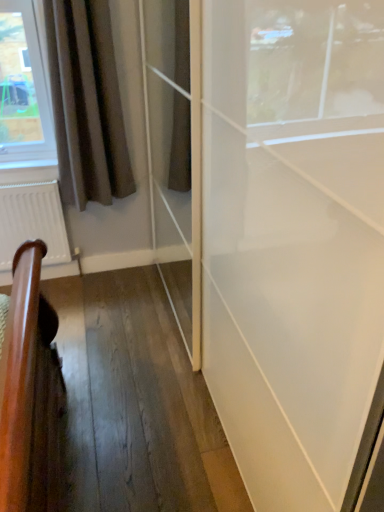
Question: From a real-world perspective, is white matte radiator at lower left positioned above or below brown fabric curtain at left?

Choices:
 (A) above
 (B) below

Answer: (B)

Question: Is white matte radiator at lower left wider or thinner than brown fabric curtain at left?

Choices:
 (A) wide
 (B) thin

Answer: (B)

Question: From their relative heights in the image, would you say white matte radiator at lower left is taller or shorter than brown fabric curtain at left?

Choices:
 (A) short
 (B) tall

Answer: (A)

Question: In terms of size, does brown fabric curtain at left appear bigger or smaller than white matte radiator at lower left?

Choices:
 (A) big
 (B) small

Answer: (A)

Question: Considering the positions of brown fabric curtain at left and white matte radiator at lower left in the image, is brown fabric curtain at left taller or shorter than white matte radiator at lower left?

Choices:
 (A) tall
 (B) short

Answer: (A)

Question: Is point (49, 18) closer or farther from the camera than point (4, 263)?

Choices:
 (A) farther
 (B) closer

Answer: (B)

Question: Is brown fabric curtain at left wider or thinner than white matte radiator at lower left?

Choices:
 (A) wide
 (B) thin

Answer: (A)